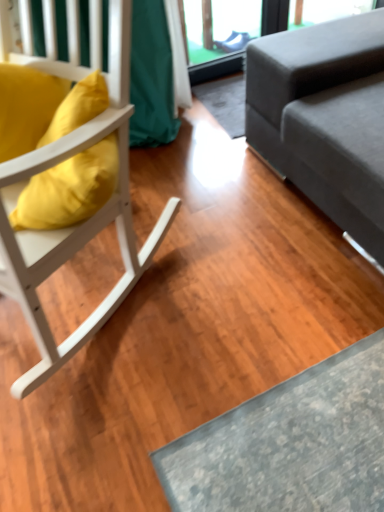
The image size is (384, 512). I want to click on free spot to the right of white wood chair at left, so click(x=252, y=292).